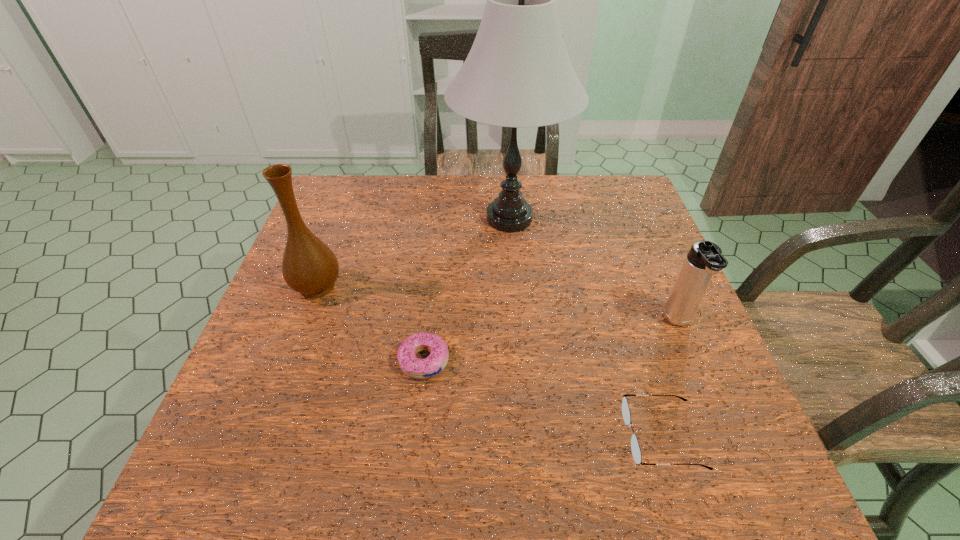
Identify the location of vacant area that lies between the third tallest object and the nearest object. Image resolution: width=960 pixels, height=540 pixels. (670, 379).

What are the coordinates of `empty space that is in between the fourth shortest object and the third shortest object` in the screenshot? It's located at (498, 304).

I want to click on free space between the farthest object and the third farthest object, so click(x=594, y=271).

This screenshot has width=960, height=540. Find the location of `free space between the spectacles and the farthest object`. free space between the spectacles and the farthest object is located at coordinates (586, 327).

Where is `free space between the rightmost object and the farthest object`? Image resolution: width=960 pixels, height=540 pixels. free space between the rightmost object and the farthest object is located at coordinates [x=594, y=271].

Locate an element on the screen. empty space between the lamp and the second nearest object is located at coordinates (467, 290).

Locate an element on the screen. The width and height of the screenshot is (960, 540). free spot between the third tallest object and the tallest object is located at coordinates (594, 271).

The image size is (960, 540). In order to click on empty location between the leftmost object and the third farthest object in this screenshot , I will do `click(498, 304)`.

This screenshot has width=960, height=540. Identify the location of free point between the nearest object and the farthest object. (586, 327).

Point out which object is positioned as the nearest to the rightmost object. Please provide its 2D coordinates. Your answer should be formatted as a tuple, i.e. [(x, y)], where the tuple contains the x and y coordinates of a point satisfying the conditions above.

[(635, 448)]